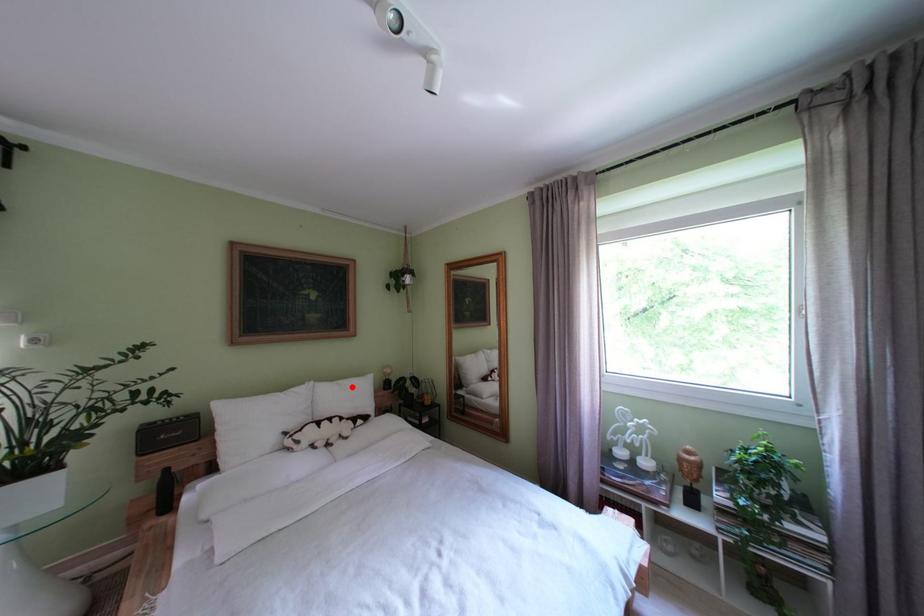
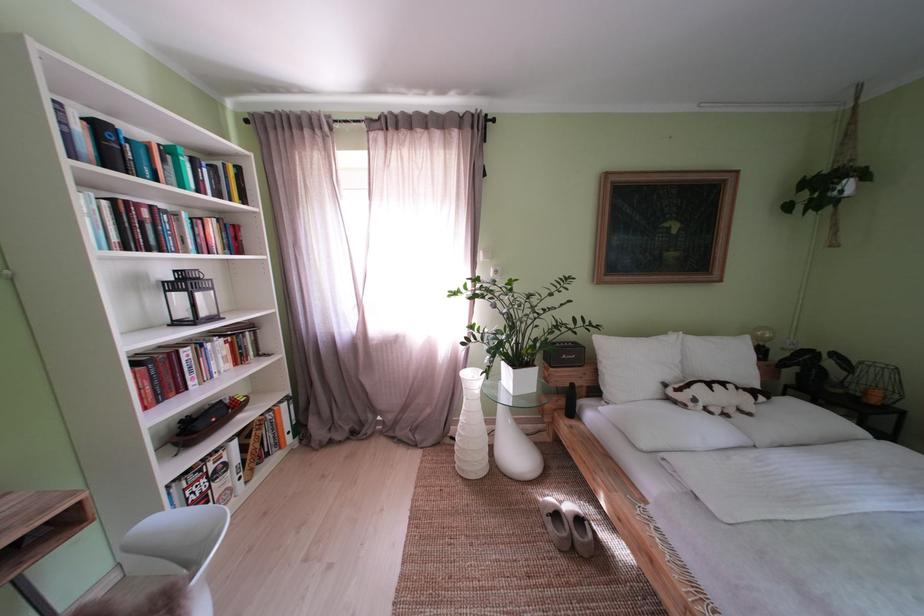
Find the pixel in the second image that matches the highlighted location in the first image.

(723, 344)